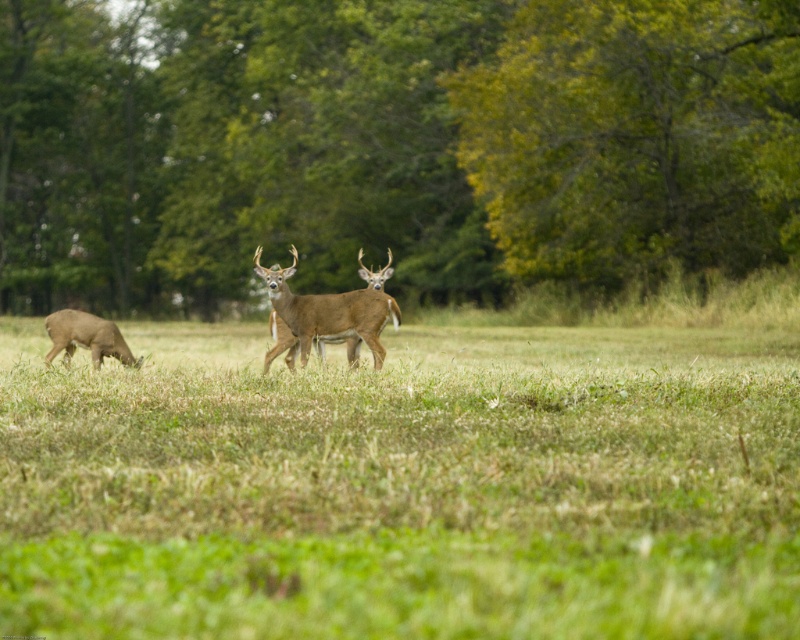
You are standing at the center of the field and see the point marked at coordinates (324, 316). What animal is located at that point?

The brown velvet deer at center is located at the point marked at coordinates (324, 316).

You are standing in the field and want to reach the point marked at coordinates point (254, 385). If you walk straight towards it, how far will you have to walk?

The point (254, 385) is 36.87 feet away from the viewer, so you will have to walk 36.87 feet to reach it.

In the scene shown: You are standing at point A, which is at coordinates (404, 486). Looking around, you notice green grass at center. Can you tell me what is located exactly at your current position?

At point (404, 486) lies green grass at center.